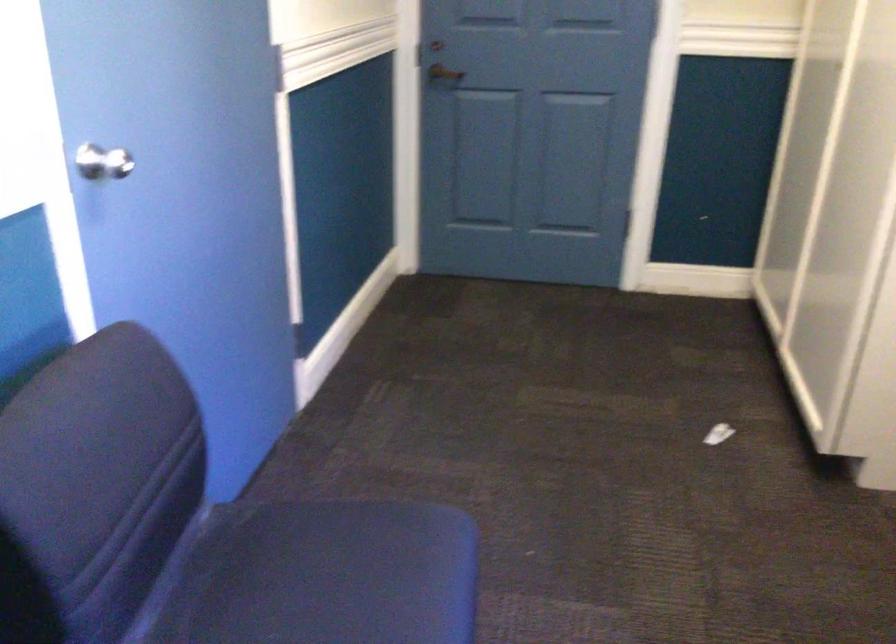
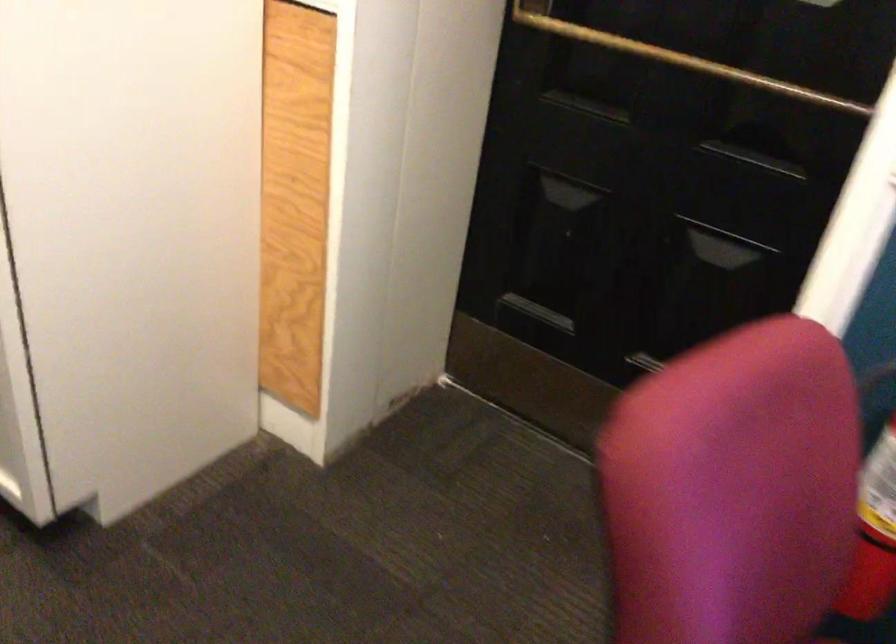
How did the camera likely rotate?

The camera's rotation is toward right-down.